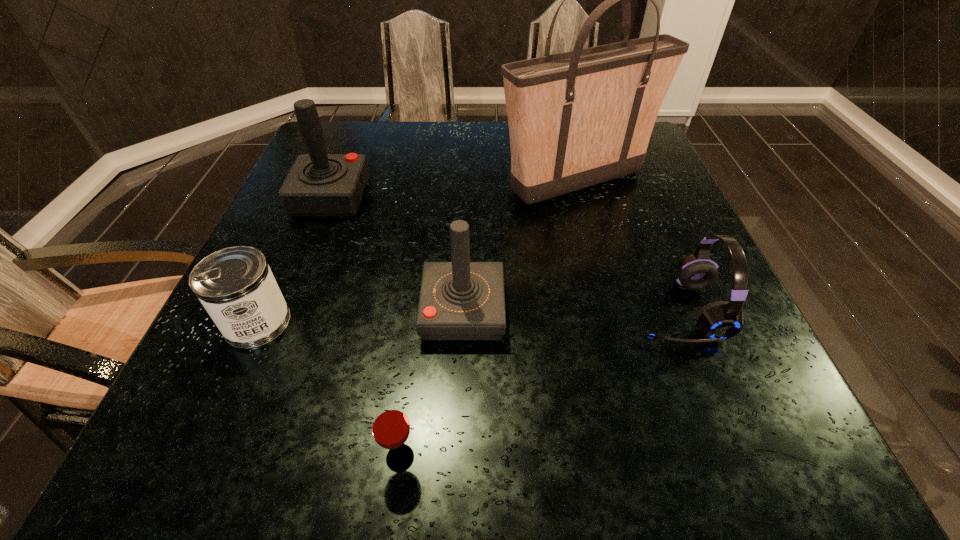
Identify the location of headset situated at the right edge. (721, 320).

Find the location of a particular element. The image size is (960, 540). object that is at the far right corner is located at coordinates (576, 119).

You are a GUI agent. You are given a task and a screenshot of the screen. Output one action in this format:
    pyautogui.click(x=<x>, y=<y>)
    Task: Click on the vacant position at the far edge of the desktop
    The height and width of the screenshot is (540, 960).
    Given the screenshot: What is the action you would take?
    pyautogui.click(x=464, y=131)

Image resolution: width=960 pixels, height=540 pixels. In the image, there is a desktop. What are the coordinates of `vacant space at the near edge` in the screenshot? It's located at (324, 418).

This screenshot has width=960, height=540. Find the location of `vacant area at the left edge`. vacant area at the left edge is located at coordinates (202, 367).

This screenshot has width=960, height=540. Identify the location of vacant region at the right edge of the desktop. (674, 249).

Where is `vacant space that's between the left joystick and the shopping bag`? vacant space that's between the left joystick and the shopping bag is located at coordinates (454, 190).

The image size is (960, 540). Find the location of `free point between the can and the nearer joystick`. free point between the can and the nearer joystick is located at coordinates (360, 316).

Where is `empty space that is in between the can and the right joystick`? empty space that is in between the can and the right joystick is located at coordinates (360, 316).

Locate an element on the screen. Image resolution: width=960 pixels, height=540 pixels. vacant region between the third tallest object and the can is located at coordinates (360, 316).